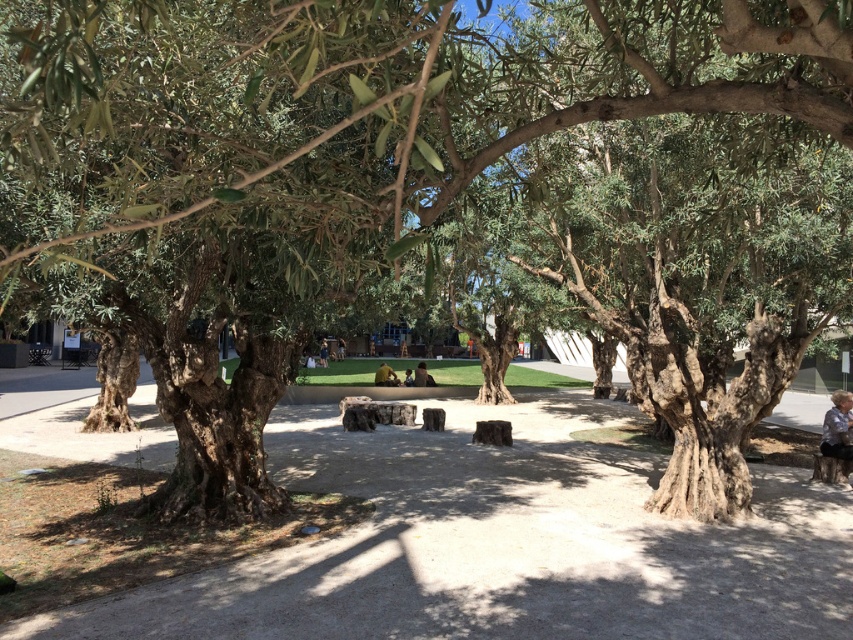
Question: Among these objects, which one is nearest to the camera?

Choices:
 (A) yellow fabric person at center
 (B) dark brown leather jacket at center
 (C) blue denim shirt at lower right

Answer: (C)

Question: Which point is farther to the camera?

Choices:
 (A) (833, 424)
 (B) (424, 376)
 (C) (321, 360)

Answer: (C)

Question: Does yellow fabric person at center have a smaller size compared to dark brown leather jacket at center?

Choices:
 (A) no
 (B) yes

Answer: (B)

Question: Which object is the farthest from the blue denim shirt at lower right?

Choices:
 (A) dark blue jeans at center
 (B) yellow fabric person at center

Answer: (A)

Question: Can you confirm if blue denim shirt at lower right is positioned to the right of dark brown leather jacket at center?

Choices:
 (A) yes
 (B) no

Answer: (A)

Question: Can you confirm if blue denim shirt at lower right is smaller than yellow fabric person at center?

Choices:
 (A) no
 (B) yes

Answer: (B)